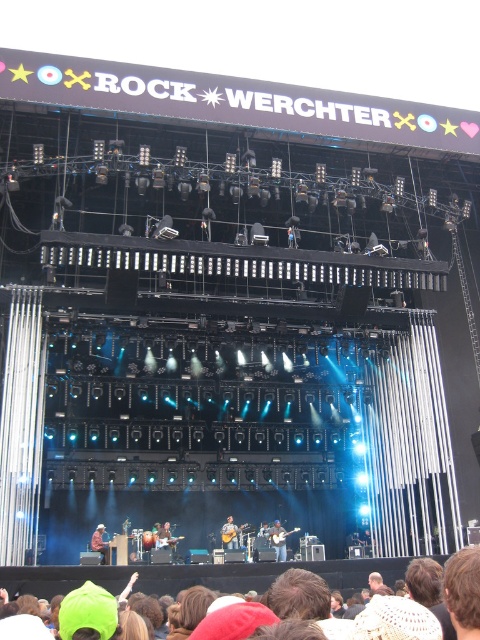
Question: Can you confirm if brown leather jacket at center is thinner than shiny brown guitar at center?

Choices:
 (A) no
 (B) yes

Answer: (A)

Question: Which point appears farthest from the camera in this image?

Choices:
 (A) (106, 548)
 (B) (229, 531)
 (C) (170, 541)

Answer: (B)

Question: Estimate the real-world distances between objects in this image. Which object is farther from the light brown wood guitar at center?

Choices:
 (A) brown leather jacket at center
 (B) wooden acoustic guitar at center

Answer: (A)

Question: Is light brown wood guitar at center above shiny brown guitar at center?

Choices:
 (A) yes
 (B) no

Answer: (B)

Question: Among these points, which one is nearest to the camera?

Choices:
 (A) (100, 524)
 (B) (233, 534)
 (C) (280, 547)
 (D) (163, 541)

Answer: (D)

Question: Does brown leather jacket at center have a lesser width compared to shiny brown guitar at center?

Choices:
 (A) yes
 (B) no

Answer: (B)